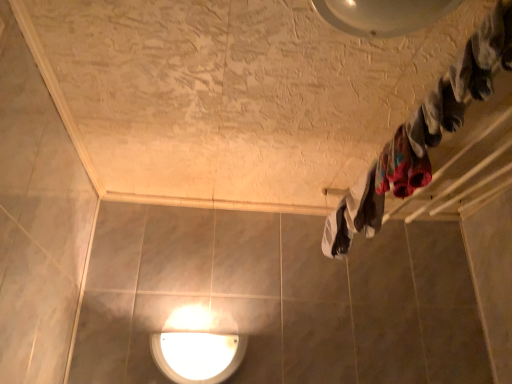
Question: Is white fabric at center, which ranks as the 2th clothing in front-to-back order, shorter than white glossy light fixture at center?

Choices:
 (A) yes
 (B) no

Answer: (A)

Question: Is white fabric at center, the 1th clothing positioned from the back, in front of white glossy light fixture at center?

Choices:
 (A) no
 (B) yes

Answer: (B)

Question: Is white fabric at center, the 1th clothing positioned from the back, located outside white glossy light fixture at center?

Choices:
 (A) yes
 (B) no

Answer: (A)

Question: Considering the relative sizes of white fabric at center, the 1th clothing positioned from the back, and white glossy light fixture at center in the image provided, is white fabric at center, the 1th clothing positioned from the back, smaller than white glossy light fixture at center?

Choices:
 (A) yes
 (B) no

Answer: (B)

Question: Could you tell me if white fabric at center, which ranks as the 2th clothing in front-to-back order, is facing white glossy light fixture at center?

Choices:
 (A) no
 (B) yes

Answer: (A)

Question: Is multicolored fabric at upper right, the 2th clothing viewed from the back, taller or shorter than white glossy light fixture at center?

Choices:
 (A) tall
 (B) short

Answer: (B)

Question: Do you think multicolored fabric at upper right, which appears as the first clothing when viewed from the front, is within white glossy light fixture at center, or outside of it?

Choices:
 (A) inside
 (B) outside

Answer: (B)

Question: Is point (382, 152) positioned closer to the camera than point (177, 340)?

Choices:
 (A) farther
 (B) closer

Answer: (B)

Question: Is multicolored fabric at upper right, which appears as the first clothing when viewed from the front, wider or thinner than white glossy light fixture at center?

Choices:
 (A) thin
 (B) wide

Answer: (B)

Question: Choose the correct answer: Is multicolored fabric at upper right, which appears as the first clothing when viewed from the front, inside white fabric at center, the 1th clothing positioned from the back, or outside it?

Choices:
 (A) inside
 (B) outside

Answer: (B)

Question: Looking at the image, does multicolored fabric at upper right, the 2th clothing viewed from the back, seem bigger or smaller compared to white fabric at center, the 1th clothing positioned from the back?

Choices:
 (A) big
 (B) small

Answer: (B)

Question: Does point 418,163 appear closer or farther from the camera than point 347,241?

Choices:
 (A) closer
 (B) farther

Answer: (A)

Question: Is multicolored fabric at upper right, which appears as the first clothing when viewed from the front, wider or thinner than white fabric at center, which ranks as the 2th clothing in front-to-back order?

Choices:
 (A) wide
 (B) thin

Answer: (B)

Question: Is white glossy light fixture at center wider or thinner than multicolored fabric at upper right, which appears as the first clothing when viewed from the front?

Choices:
 (A) thin
 (B) wide

Answer: (A)

Question: From a real-world perspective, is white glossy light fixture at center above or below multicolored fabric at upper right, which appears as the first clothing when viewed from the front?

Choices:
 (A) below
 (B) above

Answer: (A)